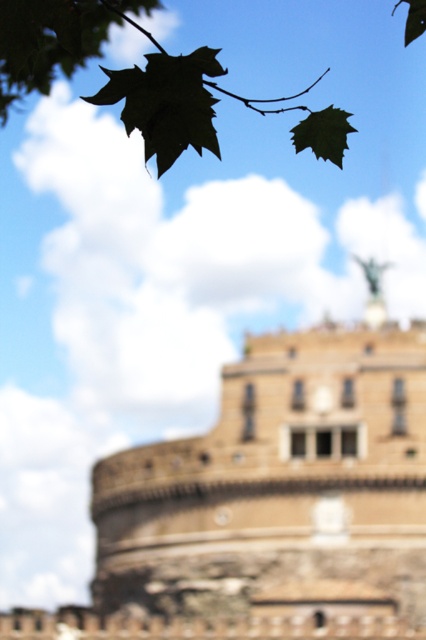
You are a photographer trying to capture the historic stone structure in the image. You notice two green leaves at the upper left corner of your frame. Which one is taller between the green leafy branch at upper left and the green matte leaf at upper left?

The green leafy branch at upper left is taller than the green matte leaf at upper left.

You are a photographer who wants to capture the historic stone structure without any leaves blocking the view. Which leaf, the green matte leaf at upper left or the green matte leaf at upper center, is closer to the left edge of the photo?

The green matte leaf at upper left is positioned on the left side of green matte leaf at upper center, so the green matte leaf at upper left is closer to the left edge of the photo.